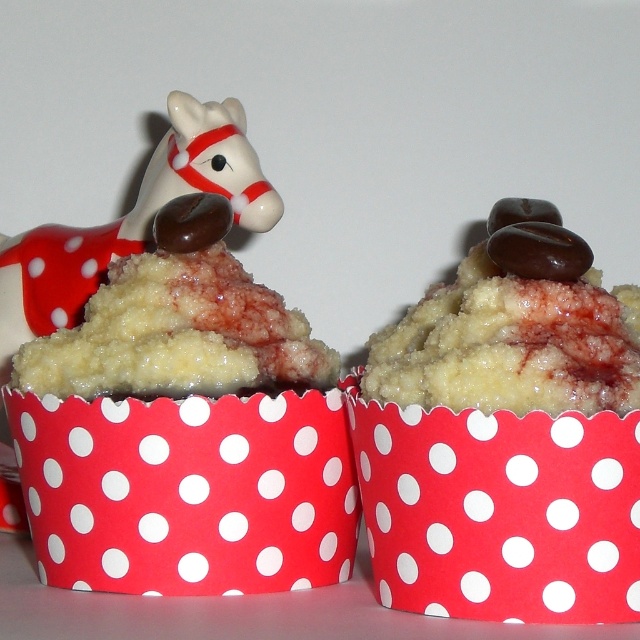
Question: Among these points, which one is nearest to the camera?

Choices:
 (A) (627, 531)
 (B) (120, 369)

Answer: (A)

Question: Does matte white cupcake at upper left have a lesser width compared to matte chocolate cupcake at center?

Choices:
 (A) no
 (B) yes

Answer: (A)

Question: Is matte white cupcake at upper left smaller than matte chocolate cupcake at center?

Choices:
 (A) yes
 (B) no

Answer: (A)

Question: Which point is farther from the camera taking this photo?

Choices:
 (A) (564, 568)
 (B) (77, 432)

Answer: (B)

Question: Is matte white cupcake at upper left positioned at the back of matte chocolate cupcake at center?

Choices:
 (A) yes
 (B) no

Answer: (A)